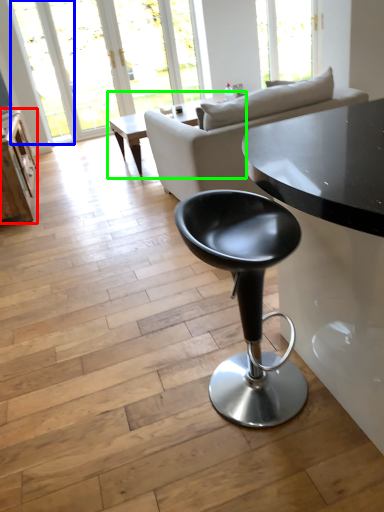
Question: Which object is the farthest from table (highlighted by a red box)? Choose among these: window (highlighted by a blue box) or coffee table (highlighted by a green box).

Choices:
 (A) window
 (B) coffee table

Answer: (A)